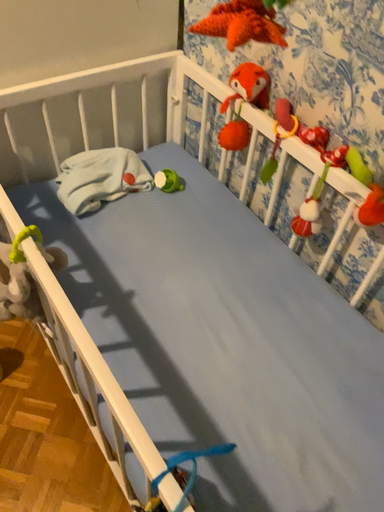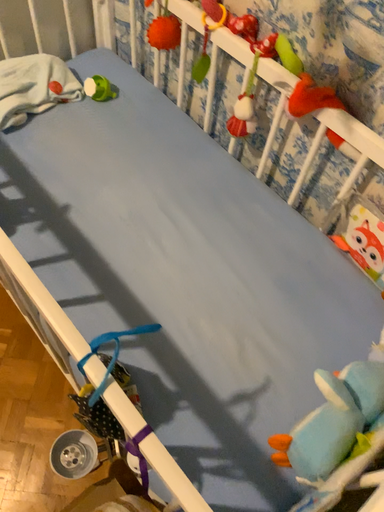
Question: How did the camera likely rotate when shooting the video?

Choices:
 (A) rotated upward
 (B) rotated downward

Answer: (B)